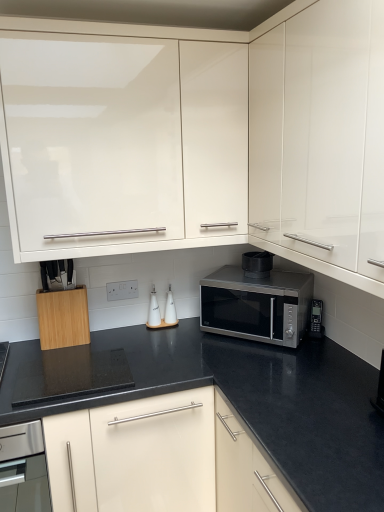
The height and width of the screenshot is (512, 384). In order to click on blank space situated above satin silver microwave at center (from a real-world perspective) in this screenshot , I will do `click(249, 275)`.